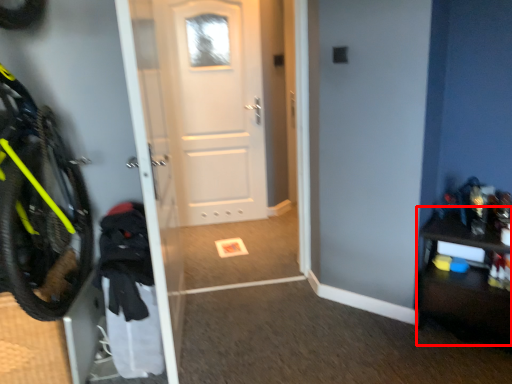
Question: Considering the relative positions of dresser (annotated by the red box) and door in the image provided, where is dresser (annotated by the red box) located with respect to the staircase?

Choices:
 (A) left
 (B) right

Answer: (B)